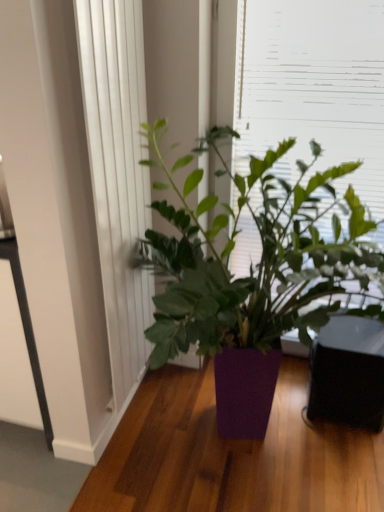
At what (x,y) coordinates should I click in order to perform the action: click on free space underneath purple matte plant at center (from a real-world perspective). Please return your answer as a coordinate pair (x, y). The width and height of the screenshot is (384, 512). Looking at the image, I should click on (245, 457).